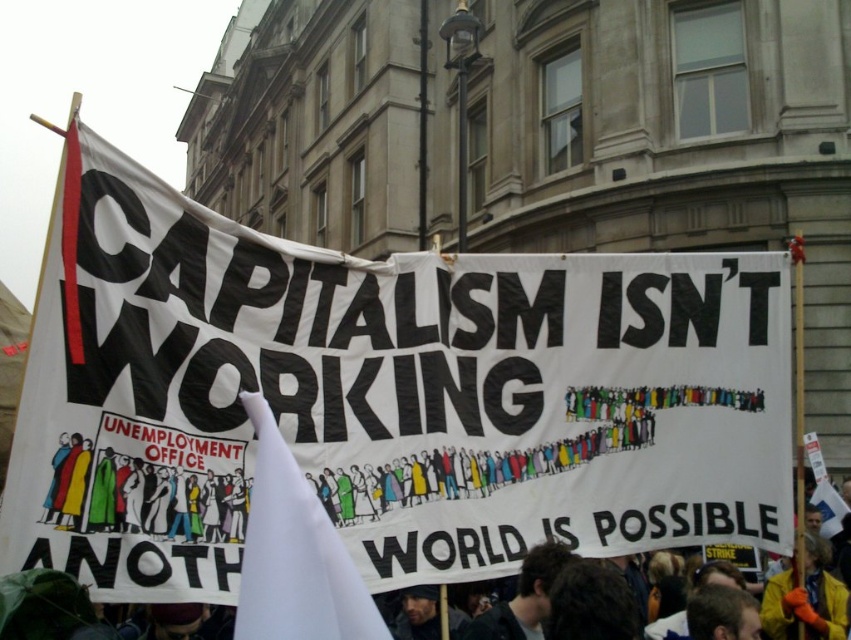
Question: Estimate the real-world distances between objects in this image. Which object is closer to the white fabric banner at center?

Choices:
 (A) white fabric flag at center
 (B) white fabric at center

Answer: (B)

Question: Which of the following is the closest to the observer?

Choices:
 (A) (328, 522)
 (B) (518, 420)
 (C) (210, 483)

Answer: (A)

Question: Does white fabric banner at center have a smaller size compared to white fabric flag at center?

Choices:
 (A) no
 (B) yes

Answer: (A)

Question: Is white fabric banner at center to the left of white fabric flag at center from the viewer's perspective?

Choices:
 (A) no
 (B) yes

Answer: (A)

Question: Is white fabric at center behind white fabric flag at center?

Choices:
 (A) yes
 (B) no

Answer: (A)

Question: Among these points, which one is nearest to the camera?

Choices:
 (A) (304, 531)
 (B) (643, 532)

Answer: (A)